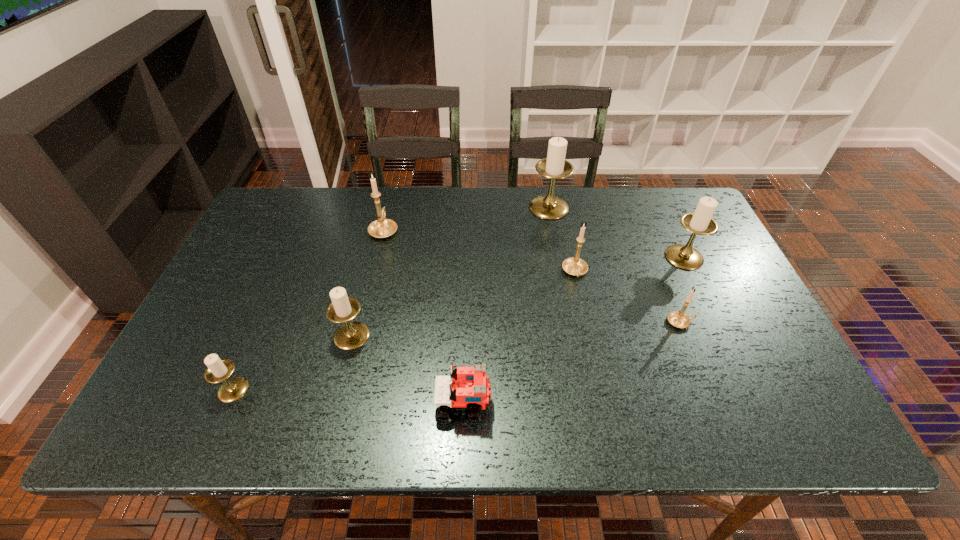
Identify which white candle holder is located as the nearest to the Lego. Please provide its 2D coordinates. Your answer should be formatted as a tuple, i.e. [(x, y)], where the tuple contains the x and y coordinates of a point satisfying the conditions above.

[(351, 335)]

Locate an element on the screen. the closest gold candle holder to the second nearest gold candle holder is located at coordinates (678, 319).

The width and height of the screenshot is (960, 540). Identify the location of gold candle holder that is the second nearest to the red Lego. (678, 319).

You are a GUI agent. You are given a task and a screenshot of the screen. Output one action in this format:
    pyautogui.click(x=<x>, y=<y>)
    Task: Click on the vacant space that satisfies the following two spatial constraints: 1. on the front side of the biggest white candle holder; 2. on the left side of the second biggest white candle holder
    
    Given the screenshot: What is the action you would take?
    (558, 257)

This screenshot has width=960, height=540. Find the location of `vacant area that satisfies the following two spatial constraints: 1. on the front side of the second farthest white candle holder; 2. on the right side of the biggest white candle holder`. vacant area that satisfies the following two spatial constraints: 1. on the front side of the second farthest white candle holder; 2. on the right side of the biggest white candle holder is located at coordinates (558, 257).

Identify the location of vacant space that satisfies the following two spatial constraints: 1. on the handle side of the farthest white candle holder; 2. on the left side of the biggest gold candle holder. The width and height of the screenshot is (960, 540). (389, 207).